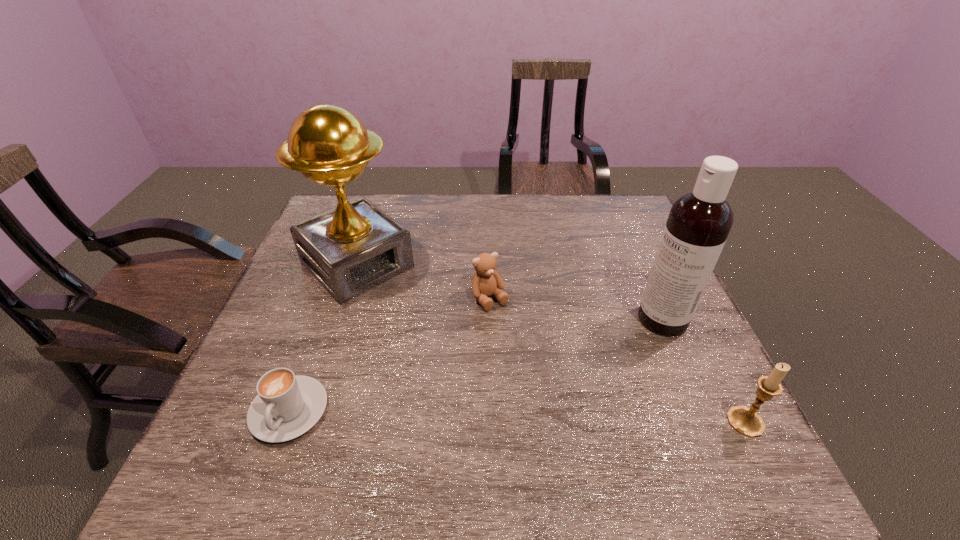
Find the location of `vacant space situated 0.220m on the front-facing side of the fourth tallest object`. vacant space situated 0.220m on the front-facing side of the fourth tallest object is located at coordinates (547, 376).

The width and height of the screenshot is (960, 540). I want to click on blank area located 0.150m on the front-facing side of the fourth tallest object, so click(x=530, y=354).

I want to click on vacant space located on the front-facing side of the fourth tallest object, so click(x=558, y=390).

You are a GUI agent. You are given a task and a screenshot of the screen. Output one action in this format:
    pyautogui.click(x=<x>, y=<y>)
    Task: Click on the vacant area situated 0.180m on the label side of the dishwasher detergent
    The width and height of the screenshot is (960, 540).
    Given the screenshot: What is the action you would take?
    pyautogui.click(x=587, y=358)

At what (x,y) coordinates should I click in order to perform the action: click on vacant space located 0.300m on the label side of the dishwasher detergent. Please return your answer as a coordinate pair (x, y). Looking at the image, I should click on (543, 380).

This screenshot has width=960, height=540. Identify the location of vacant position located on the label side of the dishwasher detergent. (536, 384).

In order to click on object positioned at the far edge in this screenshot , I will do `click(355, 247)`.

You are a GUI agent. You are given a task and a screenshot of the screen. Output one action in this format:
    pyautogui.click(x=<x>, y=<y>)
    Task: Click on the cappuccino that is at the near edge
    The image size is (960, 540).
    Given the screenshot: What is the action you would take?
    pyautogui.click(x=287, y=405)

Image resolution: width=960 pixels, height=540 pixels. What are the coordinates of `candle holder positioned at the near edge` in the screenshot? It's located at (746, 421).

The height and width of the screenshot is (540, 960). Identify the location of cappuccino that is at the left edge. (287, 405).